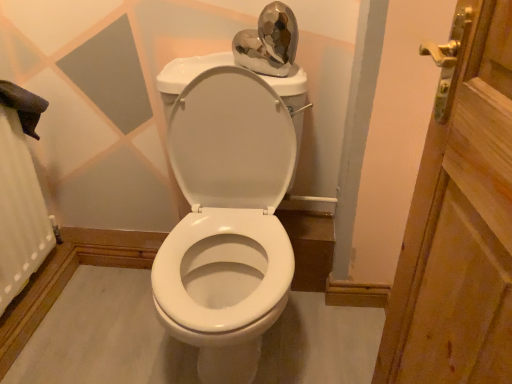
This screenshot has width=512, height=384. What do you see at coordinates (225, 214) in the screenshot? I see `white glossy toilet at center` at bounding box center [225, 214].

You are a GUI agent. You are given a task and a screenshot of the screen. Output one action in this format:
    pyautogui.click(x=<x>, y=<y>)
    Task: Click on the white glossy toilet at center
    Image resolution: width=512 pixels, height=384 pixels.
    Given the screenshot: What is the action you would take?
    pyautogui.click(x=225, y=214)

What is the approximate width of white glossy toilet at center?

27.12 inches.

Image resolution: width=512 pixels, height=384 pixels. Identify the location of white glossy toilet at center. (225, 214).